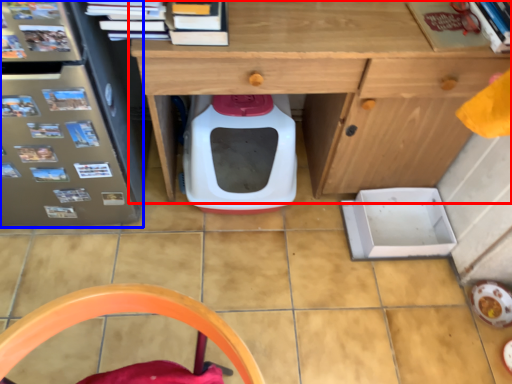
Question: Among these objects, which one is farthest to the camera, desk (highlighted by a red box) or fridge (highlighted by a blue box)?

Choices:
 (A) desk
 (B) fridge

Answer: (A)